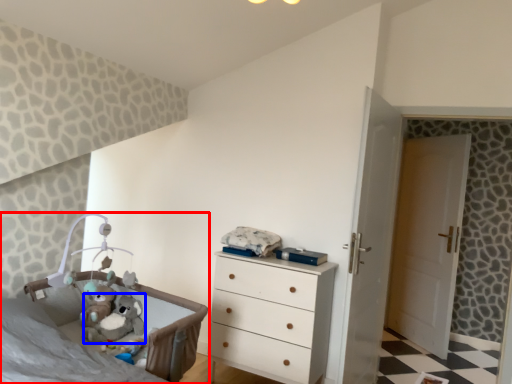
Question: Which object appears farthest to the camera in this image, infant bed (highlighted by a red box) or animal (highlighted by a blue box)?

Choices:
 (A) infant bed
 (B) animal

Answer: (B)